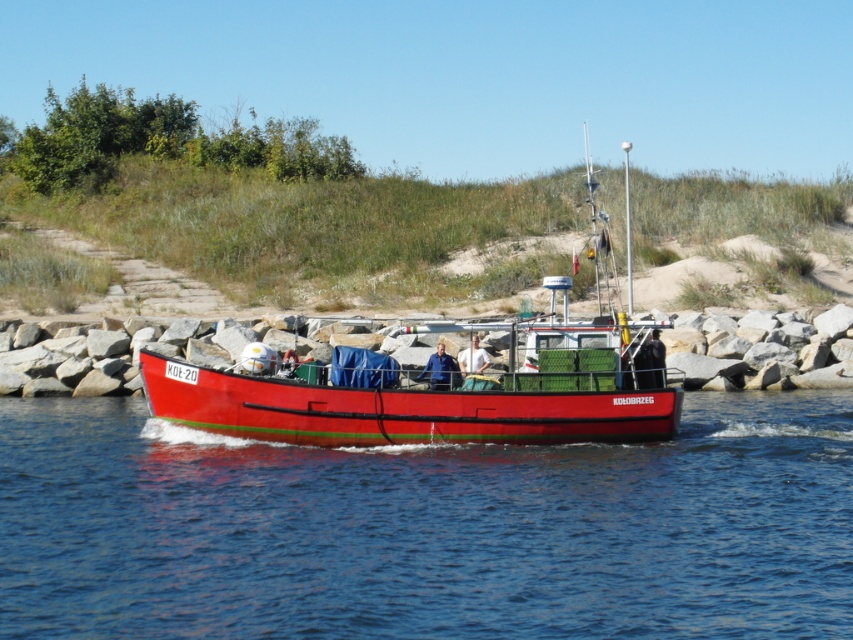
Which of these two, blue fabric jacket at center or white fabric shirt at center, stands shorter?

Standing shorter between the two is white fabric shirt at center.

You are a GUI agent. You are given a task and a screenshot of the screen. Output one action in this format:
    pyautogui.click(x=<x>, y=<y>)
    Task: Click on the blue fabric jacket at center
    
    Given the screenshot: What is the action you would take?
    pyautogui.click(x=439, y=369)

At what (x,y) coordinates should I click in order to perform the action: click on blue fabric jacket at center. Please return your answer as a coordinate pair (x, y). Looking at the image, I should click on tap(439, 369).

Does dark blue fabric jacket at center have a larger size compared to blue fabric jacket at center?

No.

Which is in front, point (639, 364) or point (432, 381)?

Positioned in front is point (432, 381).

What are the coordinates of `dark blue fabric jacket at center` in the screenshot? It's located at (650, 362).

At what (x,y) coordinates should I click in order to perform the action: click on dark blue fabric jacket at center. Please return your answer as a coordinate pair (x, y). The height and width of the screenshot is (640, 853). Looking at the image, I should click on (650, 362).

Based on the photo, between dark blue fabric jacket at center and white fabric shirt at center, which one appears on the right side from the viewer's perspective?

Positioned to the right is dark blue fabric jacket at center.

Can you confirm if dark blue fabric jacket at center is wider than white fabric shirt at center?

Correct, the width of dark blue fabric jacket at center exceeds that of white fabric shirt at center.

Where is `dark blue fabric jacket at center`? The width and height of the screenshot is (853, 640). dark blue fabric jacket at center is located at coordinates (650, 362).